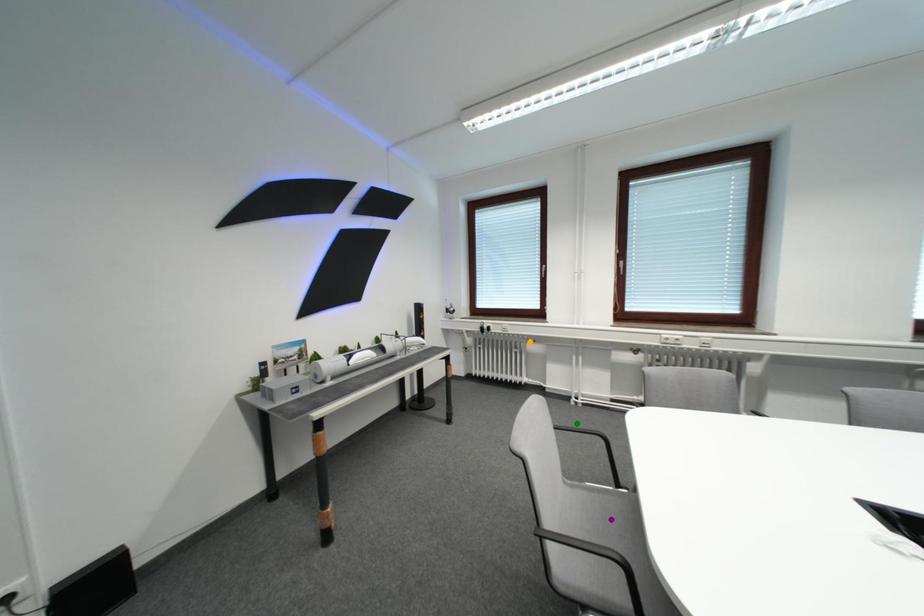
Order these from nearest to farthest:
orange point | green point | purple point

purple point, green point, orange point